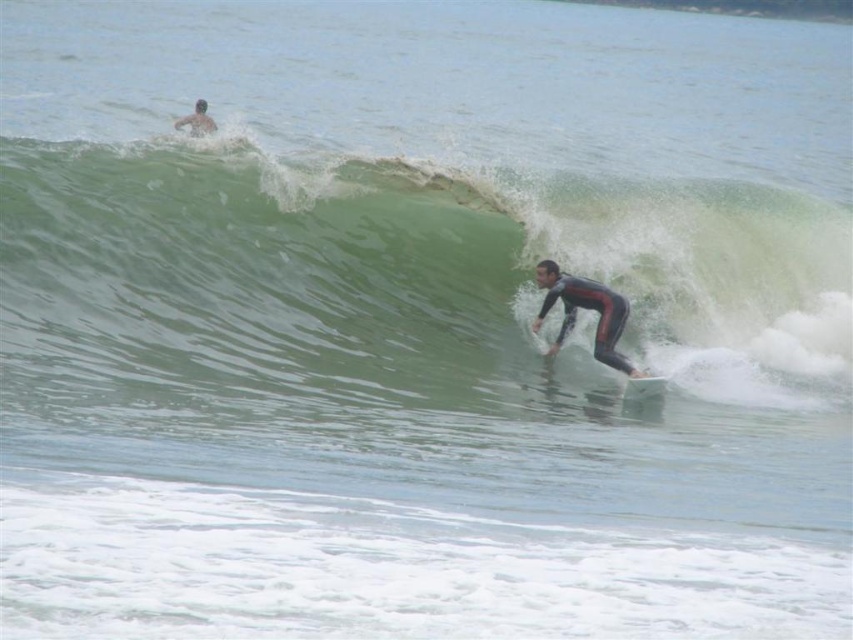
Question: Among these objects, which one is farthest from the camera?

Choices:
 (A) black matte wetsuit at center
 (B) white foam surfboard at center
 (C) green rubber wave at center
 (D) skinny man at upper left

Answer: (D)

Question: From the image, what is the correct spatial relationship of black matte wetsuit at center in relation to skinny man at upper left?

Choices:
 (A) left
 (B) right

Answer: (B)

Question: Which object appears closest to the camera in this image?

Choices:
 (A) skinny man at upper left
 (B) black matte wetsuit at center
 (C) green rubber wave at center

Answer: (C)

Question: From the image, what is the correct spatial relationship of black matte wetsuit at center in relation to white foam surfboard at center?

Choices:
 (A) left
 (B) right

Answer: (A)

Question: Does green rubber wave at center have a lesser width compared to white foam surfboard at center?

Choices:
 (A) no
 (B) yes

Answer: (A)

Question: Which object is the closest to the white foam surfboard at center?

Choices:
 (A) skinny man at upper left
 (B) black matte wetsuit at center
 (C) green rubber wave at center

Answer: (B)